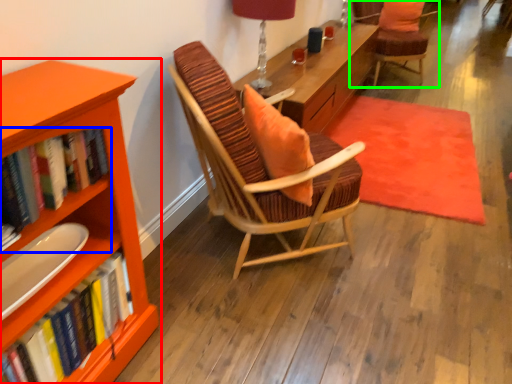
Question: Estimate the real-world distances between objects in this image. Which object is farther from bookcase (highlighted by a red box), book (highlighted by a blue box) or chair (highlighted by a green box)?

Choices:
 (A) book
 (B) chair

Answer: (B)